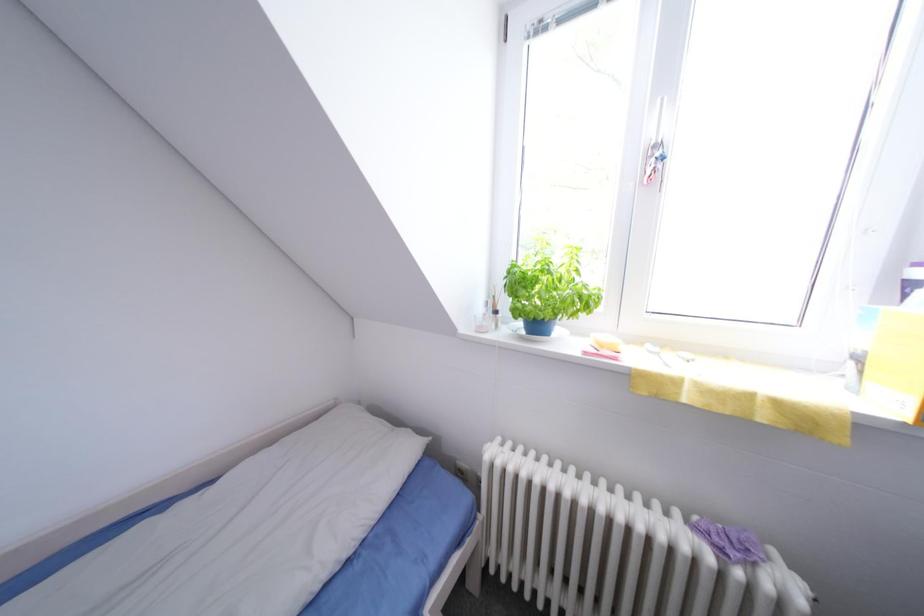
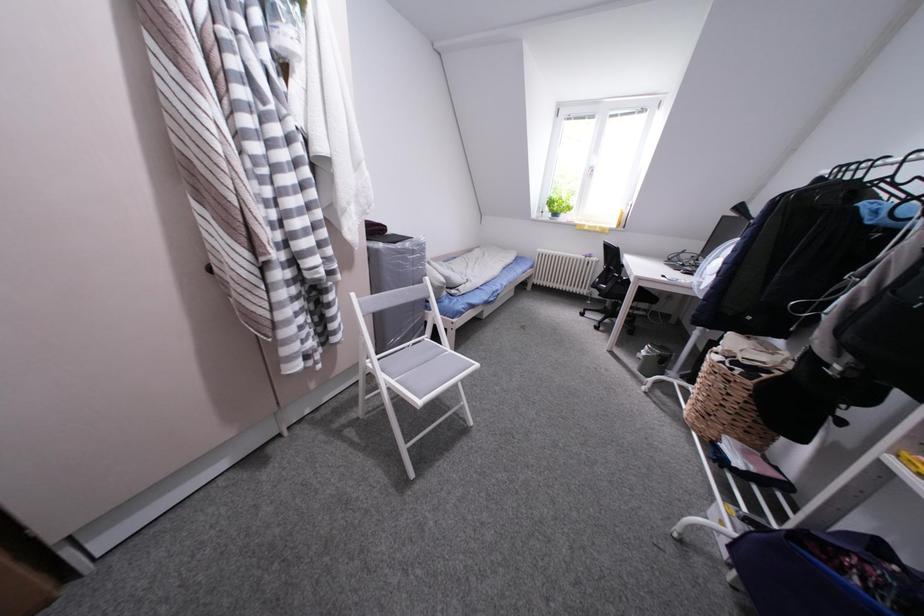
Which direction would the cameraman need to move to produce the second image?

The cameraman moved toward left, backward.